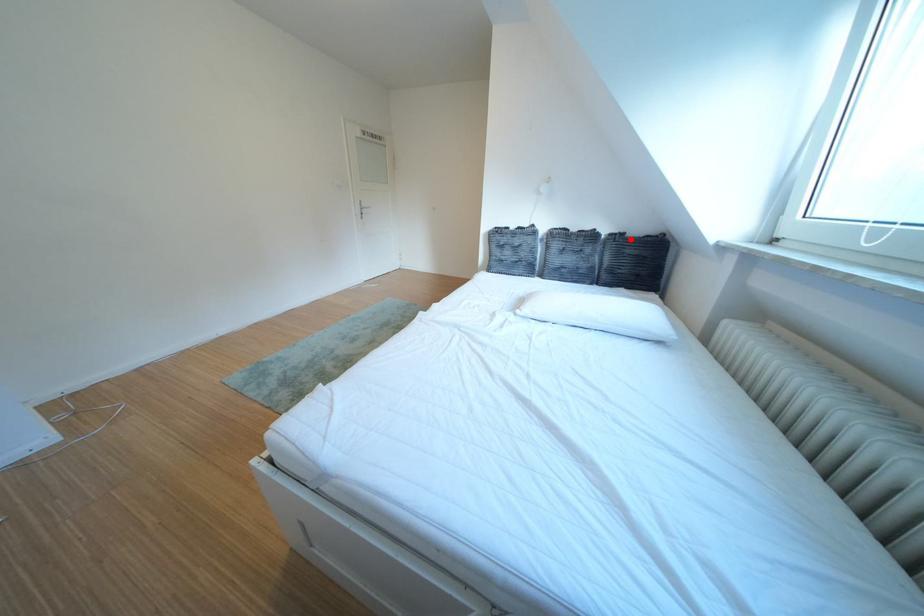
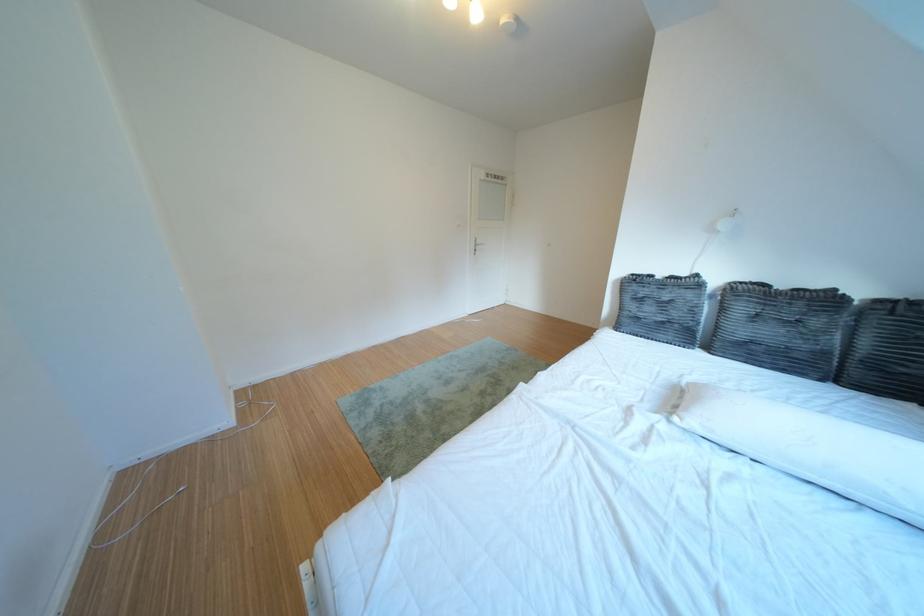
Question: I am providing you with two images of the same scene from different viewpoints. A red point is shown in image1. For the corresponding object point in image2, is it positioned nearer or farther from the camera?

Choices:
 (A) Nearer
 (B) Farther

Answer: (B)